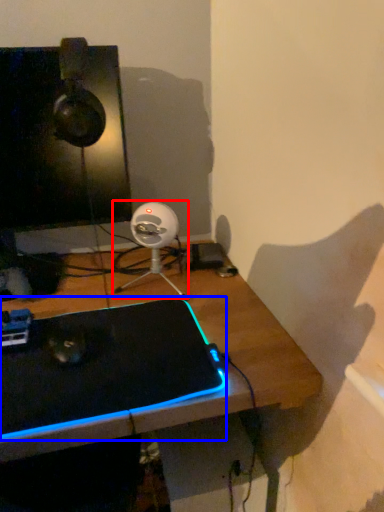
Question: Which point is closer to the camera, fan (highlighted by a red box) or laptop (highlighted by a blue box)?

Choices:
 (A) fan
 (B) laptop

Answer: (B)